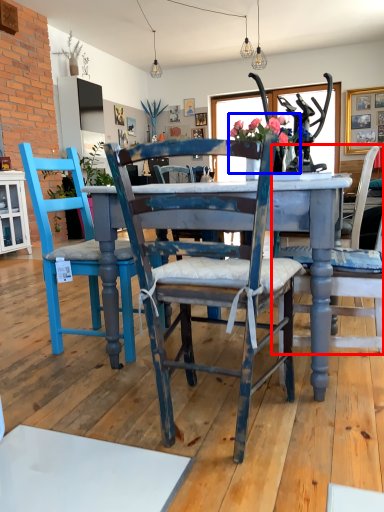
Question: Among these objects, which one is farthest to the camera, chair (highlighted by a red box) or floral arrangement (highlighted by a blue box)?

Choices:
 (A) chair
 (B) floral arrangement

Answer: (B)